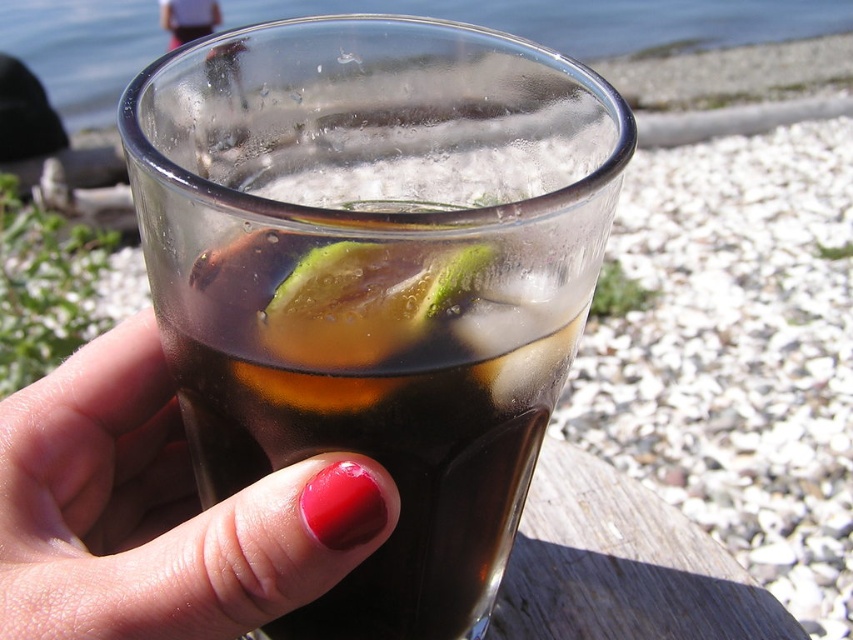
Who is more distant from viewer, (260, 179) or (57, 618)?

Positioned behind is point (260, 179).

At what (x,y) coordinates should I click in order to perform the action: click on dark glass at center. Please return your answer as a coordinate pair (x, y). This screenshot has width=853, height=640. Looking at the image, I should click on (376, 276).

Who is positioned more to the right, dark glass at center or clear glass water at upper center?

Positioned to the right is clear glass water at upper center.

Between point (306, 435) and point (796, 3), which one is positioned behind?

Point (796, 3)

Locate an element on the screen. dark glass at center is located at coordinates (376, 276).

Does glossy nail polish at center appear over clear glass water at upper center?

No.

Identify the location of glossy nail polish at center. (158, 512).